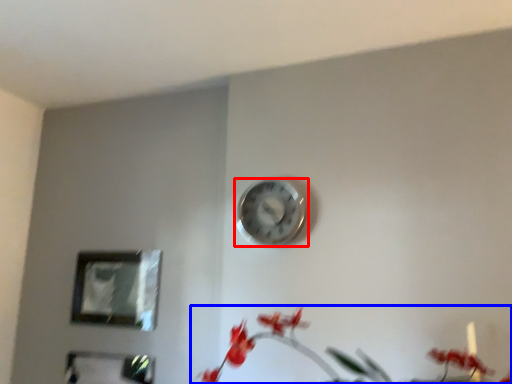
Question: Which object appears closest to the camera in this image, wall clock (highlighted by a red box) or floral arrangement (highlighted by a blue box)?

Choices:
 (A) wall clock
 (B) floral arrangement

Answer: (B)